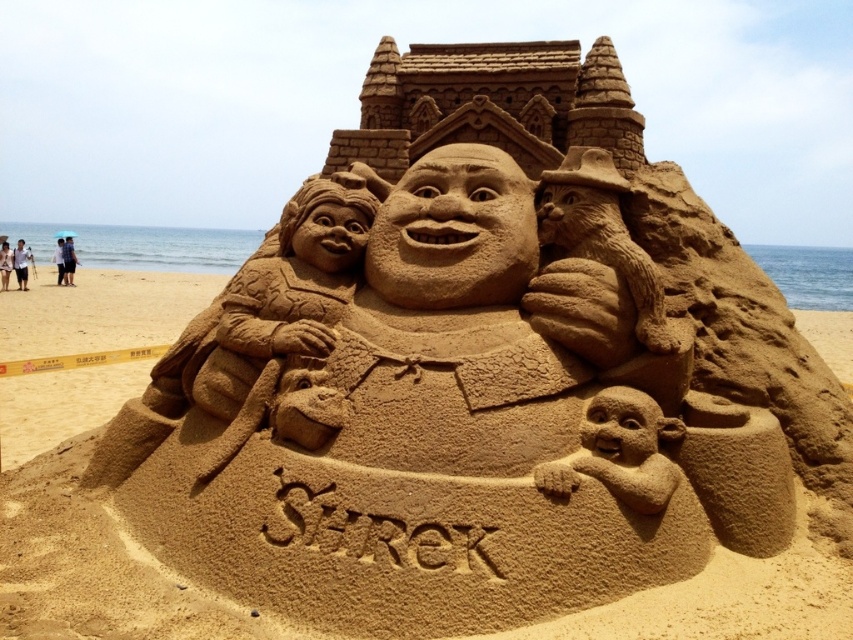
Who is positioned more to the left, smooth sand sculpture at center or dark blue fabric umbrella at upper left?

dark blue fabric umbrella at upper left

Consider the image. Between smooth sand sculpture at center and dark blue fabric umbrella at upper left, which one has less height?

Standing shorter between the two is dark blue fabric umbrella at upper left.

Is point (192, 291) positioned in front of point (65, 236)?

That is True.

Locate an element on the screen. smooth sand sculpture at center is located at coordinates (91, 531).

Is smooth sand monkey at lower center to the right of white shirt at left from the viewer's perspective?

Indeed, smooth sand monkey at lower center is positioned on the right side of white shirt at left.

Measure the distance from smooth sand monkey at lower center to white shirt at left.

A distance of 32.24 meters exists between smooth sand monkey at lower center and white shirt at left.

This screenshot has width=853, height=640. Describe the element at coordinates (619, 451) in the screenshot. I see `smooth sand monkey at lower center` at that location.

Locate an element on the screen. smooth sand monkey at lower center is located at coordinates (619, 451).

Looking at this image, is white shirt at left to the left of dark blue fabric umbrella at upper left from the viewer's perspective?

Yes, white shirt at left is to the left of dark blue fabric umbrella at upper left.

Can you confirm if white shirt at left is wider than dark blue fabric umbrella at upper left?

Indeed, white shirt at left has a greater width compared to dark blue fabric umbrella at upper left.

Who is more forward, [26,250] or [64,257]?

Point [64,257]

This screenshot has height=640, width=853. I want to click on white shirt at left, so coord(21,262).